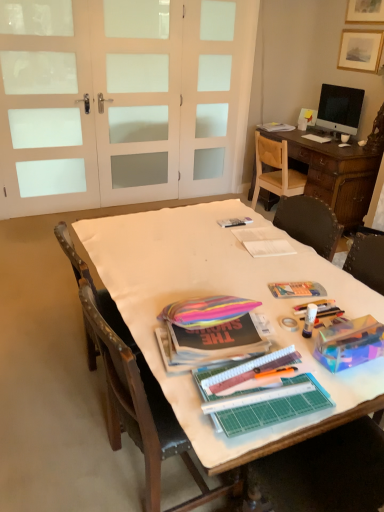
The height and width of the screenshot is (512, 384). I want to click on free space in front of matte paper magazine at center, placed as the 2th magazine when sorted from right to left, so click(x=278, y=269).